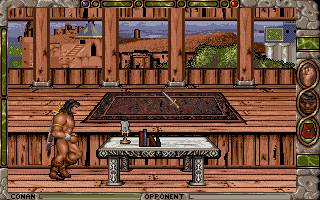
You are a GUI agent. You are given a task and a screenshot of the screen. Output one action in this format:
    pyautogui.click(x=<x>, y=<y>)
    Task: Click on the rug
    
    Given the screenshot: What is the action you would take?
    pyautogui.click(x=159, y=107)